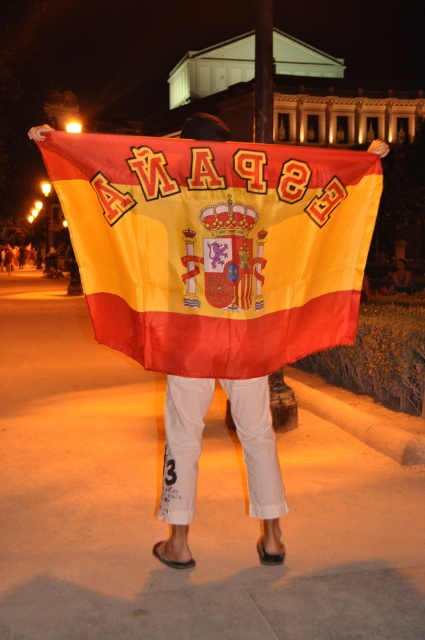
Image resolution: width=425 pixels, height=640 pixels. What do you see at coordinates (215, 246) in the screenshot?
I see `textured cotton flag at center` at bounding box center [215, 246].

Where is `textured cotton flag at center`? textured cotton flag at center is located at coordinates (215, 246).

Identify the location of textured cotton flag at center. (215, 246).